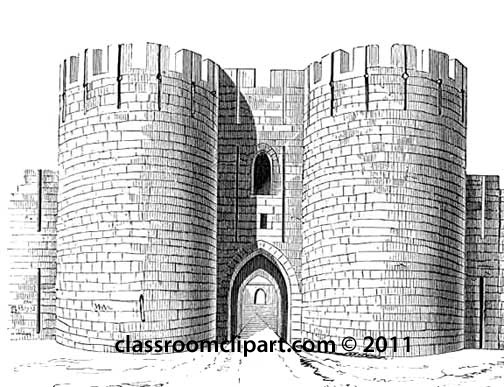
What are the coordinates of `art` in the screenshot? It's located at (262, 346).